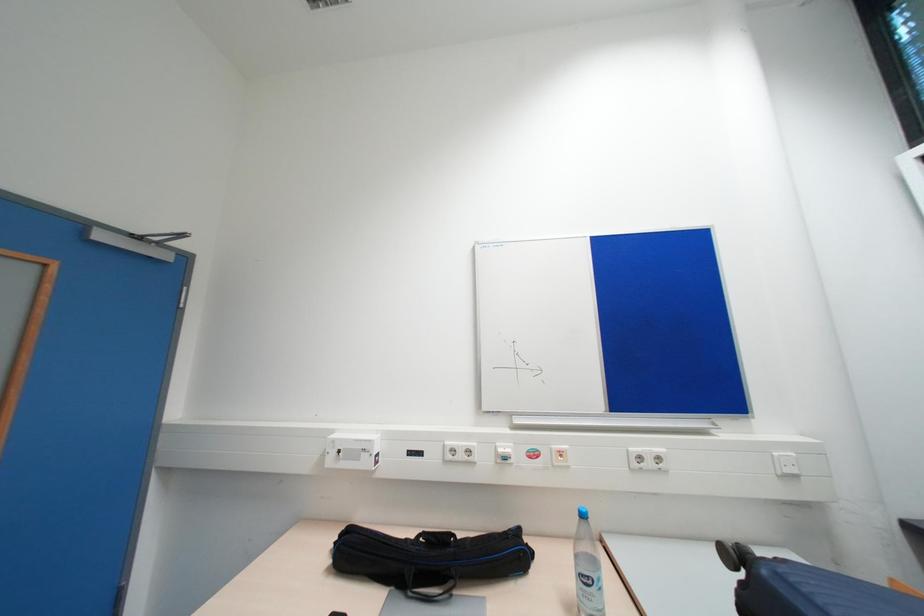
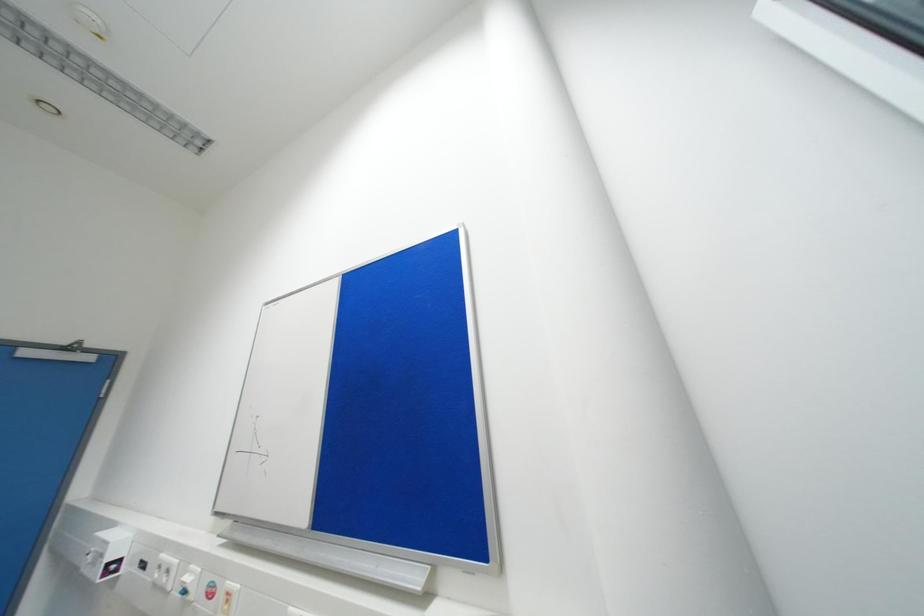
Question: The images are taken continuously from a first-person perspective. In which direction are you moving?

Choices:
 (A) Left
 (B) Right
 (C) Forward
 (D) Backward

Answer: (B)